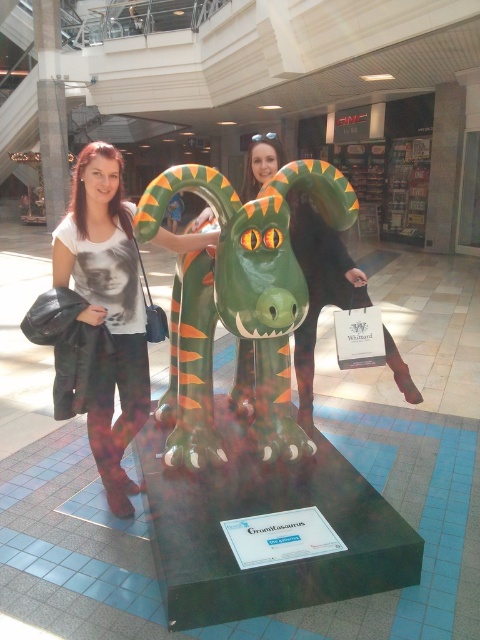
You are standing in the shopping mall and want to take a photo of the green rubber dragon at center. The mall requires all photos to be taken within a 10cm radius of the exact center point of the dragon. Given that the dragon is located at coordinates 0.469, 0.529, can you determine if your current position at coordinates 0.470, 0.530 is within the allowed range?

The green rubber dragon at center is located at coordinates (253, 300). Your current position at (254, 300) is within the 10cm radius requirement since the distance between the two points is less than 10cm.

Based on the photo, you are standing in front of the Gromitasaurus sculpture in the mall. There are two points marked on the sculpture. The first point is at coordinates point (230, 404) and the second is at point (107, 234). Which of these two points is closer to you?

The point at (230, 404) is closer to you because it is further to the viewer than the other point.